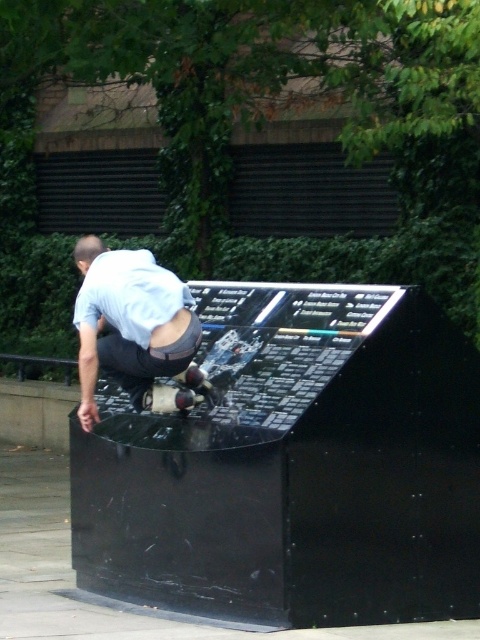
You are a photographer trying to capture the perfect shot of the light blue shirt at center and the shiny metallic skateboard at center. You need to ensure both are in focus. Given that your camera has a depth of field that can cover objects within a 6 inch range, will both subjects be in focus?

The light blue shirt at center and the shiny metallic skateboard at center are 5.78 inches apart, which is within the 6 inch depth of field range. Therefore, both subjects will be in focus.

You are designing a safety poster for skateboarders and need to highlight the visibility of the rider. Which object, the light blue shirt at center or the shiny metallic skateboard at center, has a larger width to ensure it can be seen clearly from a distance?

The light blue shirt at center has a larger width than the shiny metallic skateboard at center, making it more visible from a distance.

Based on the coordinates provided, where is the light blue shirt at center located in the image?

The light blue shirt at center is located at the 2D coordinates point of (130, 321).